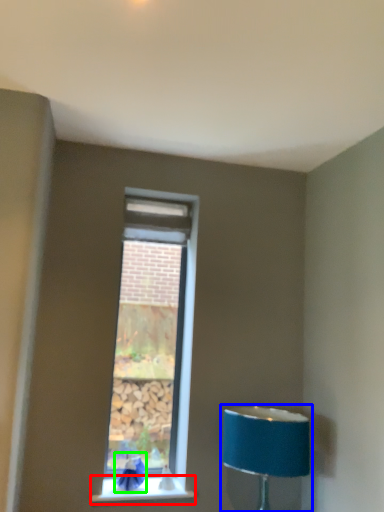
Question: Which object is the farthest from window sill (highlighted by a red box)? Choose among these: lamp (highlighted by a blue box) or swivel chair (highlighted by a green box).

Choices:
 (A) lamp
 (B) swivel chair

Answer: (A)